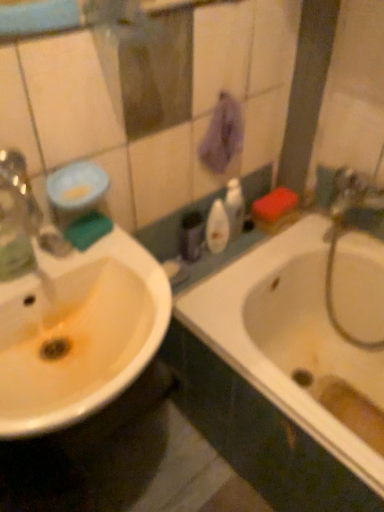
Question: From the image's perspective, is white glossy sink at left above or below green sponge at left, arranged as the 2th mouthwash when viewed from the back?

Choices:
 (A) above
 (B) below

Answer: (B)

Question: Is white glossy sink at left in front of or behind green sponge at left, positioned as the 2th mouthwash in right-to-left order, in the image?

Choices:
 (A) front
 (B) behind

Answer: (A)

Question: Estimate the real-world distances between objects in this image. Which object is closer to the white glossy bathtub at right?

Choices:
 (A) green sponge at left
 (B) purple fabric hand towel at upper center
 (C) matte purple container at center, arranged as the 2th toiletry when viewed from the right
 (D) green sponge at left, arranged as the 2th mouthwash when viewed from the back
 (E) white glossy bottle at center, marked as the first toiletry in a right-to-left arrangement

Answer: (E)

Question: Which object is positioned closest to the purple fabric hand towel at upper center?

Choices:
 (A) green sponge at left
 (B) white glossy bathtub at right
 (C) green sponge at left, acting as the 1th mouthwash starting from the front
 (D) matte purple container at center, the first toiletry from the left
 (E) translucent plastic mouthwash at center, acting as the second mouthwash starting from the front

Answer: (E)